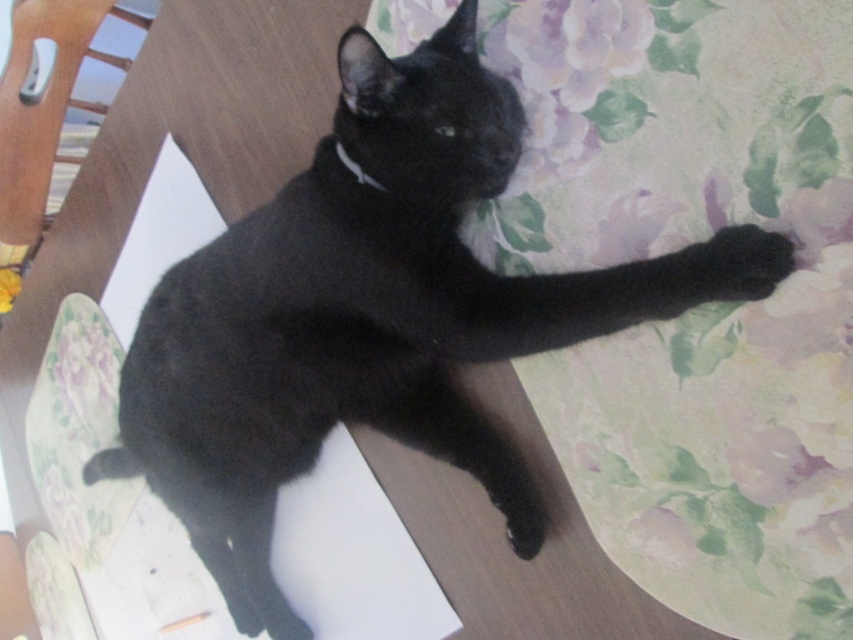
Can you confirm if black fuzzy paw at upper right is positioned to the right of silvery metallic collar at upper center?

Indeed, black fuzzy paw at upper right is positioned on the right side of silvery metallic collar at upper center.

Consider the image. Which of these two, black fuzzy paw at upper right or silvery metallic collar at upper center, stands shorter?

silvery metallic collar at upper center is shorter.

Is point (759, 260) positioned after point (358, 177)?

No, it is not.

You are a GUI agent. You are given a task and a screenshot of the screen. Output one action in this format:
    pyautogui.click(x=<x>, y=<y>)
    Task: Click on the black fuzzy paw at upper right
    The height and width of the screenshot is (640, 853).
    Given the screenshot: What is the action you would take?
    pyautogui.click(x=746, y=262)